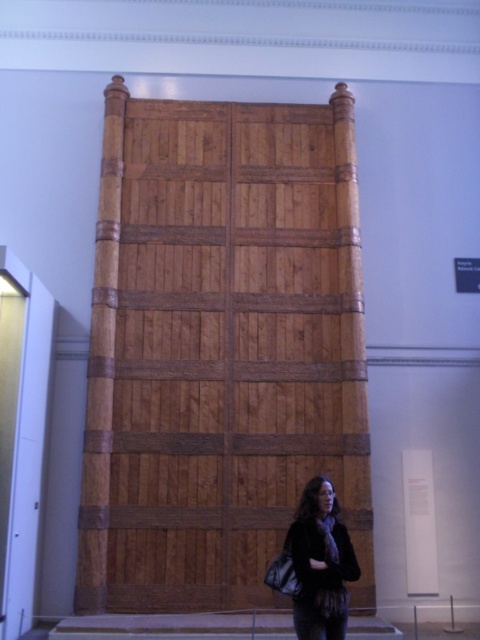
You are a museum curator planning to install a new display case for the natural wood door at center. The display case must accommodate the height of the door. Given that the dark brown leather jacket at lower center is worn by a person of average height, can you determine if the display case needs to be taller than 2 meters?

The natural wood door at center is much taller than the dark brown leather jacket at lower center, which is worn by a person of average height. Since an average person is typically around 1.7 meters tall, the door exceeds this height, so the display case must be taller than 2 meters to accommodate it.

You are standing in a museum and see the natural wood door at center and the dark brown leather jacket at lower center. Which object is positioned to the right side of the other?

The dark brown leather jacket at lower center is to the right of the natural wood door at center.